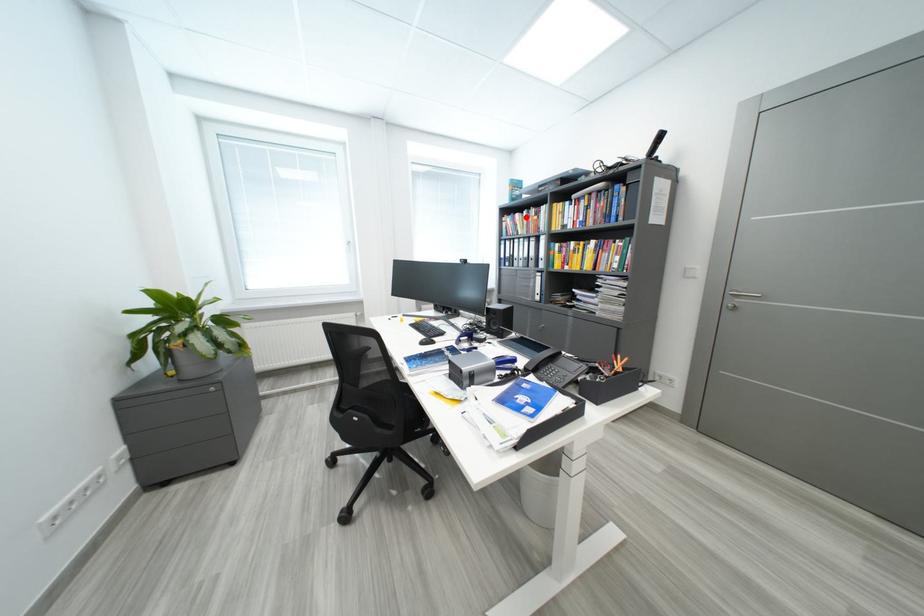
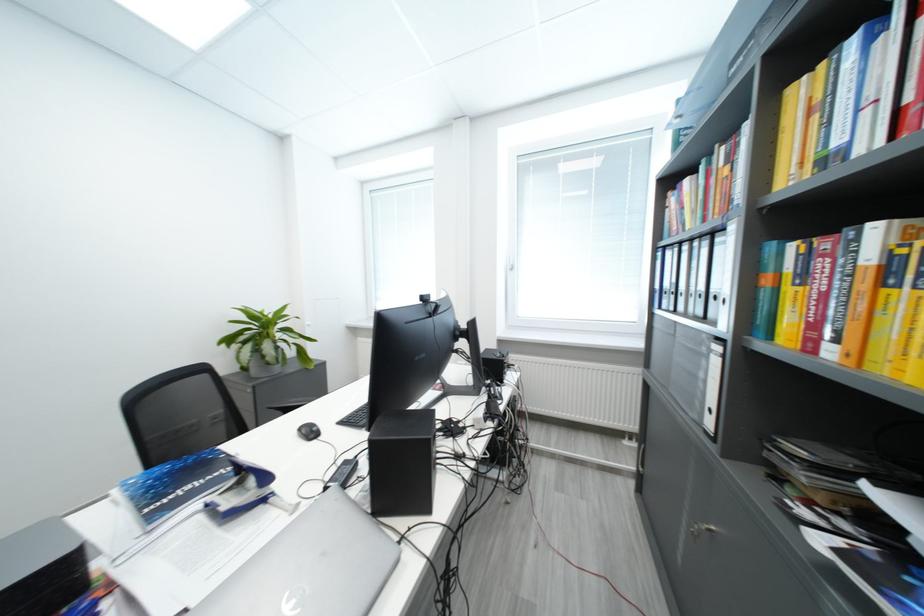
The point at the highlighted location is marked in the first image. Where is the corresponding point in the second image?

(696, 184)